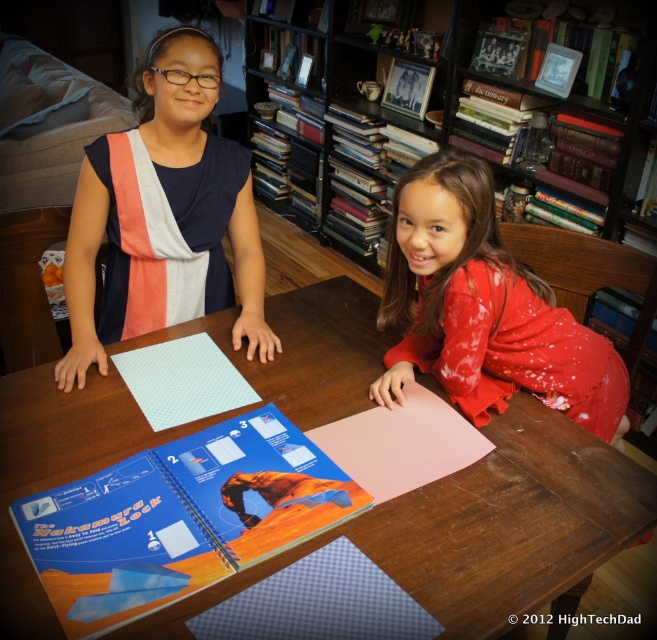
Can you confirm if wooden table at center is wider than blue fabric dress at left?

Correct, the width of wooden table at center exceeds that of blue fabric dress at left.

Locate an element on the screen. The width and height of the screenshot is (657, 640). wooden table at center is located at coordinates (482, 529).

Locate an element on the screen. This screenshot has height=640, width=657. wooden table at center is located at coordinates (x=482, y=529).

Does wooden table at center have a greater height compared to blue glossy book at center?

Yes, wooden table at center is taller than blue glossy book at center.

In the scene shown: Who is more forward, (309, 397) or (309, 524)?

Positioned in front is point (309, 524).

Does point (18, 406) come in front of point (148, 483)?

No, it is not.

This screenshot has width=657, height=640. I want to click on wooden table at center, so click(x=482, y=529).

Is point (281, 529) closer to viewer compared to point (72, 324)?

Yes, point (281, 529) is closer to viewer.

Image resolution: width=657 pixels, height=640 pixels. What do you see at coordinates (179, 518) in the screenshot?
I see `blue glossy book at center` at bounding box center [179, 518].

Locate an element on the screen. blue glossy book at center is located at coordinates (179, 518).